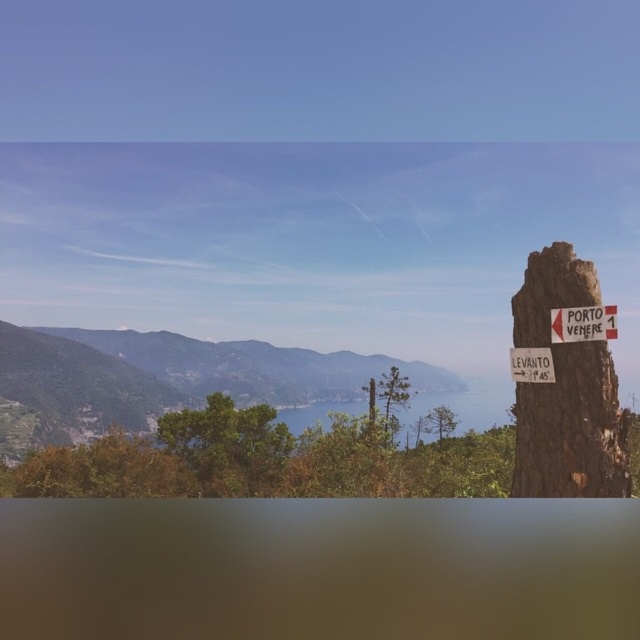
Question: Is green leafy mountain at left below brown wooden signpost at right?

Choices:
 (A) no
 (B) yes

Answer: (B)

Question: Which object is closer to the camera taking this photo?

Choices:
 (A) green leafy tree at center
 (B) green leafy mountain at left
 (C) white plastic sign at right
 (D) brown wooden signpost at right

Answer: (C)

Question: Which object is positioned farthest from the green leafy mountain at left?

Choices:
 (A) brown wooden signpost at right
 (B) white plastic sign at right

Answer: (A)

Question: Which of these objects is positioned farthest from the brown wooden signpost at right?

Choices:
 (A) green leafy tree at center
 (B) green leafy mountain at left

Answer: (B)

Question: Where is green leafy tree at center located in relation to brown wooden signpost at right in the image?

Choices:
 (A) right
 (B) left

Answer: (B)

Question: Can you confirm if green leafy tree at center is bigger than white plastic sign at right?

Choices:
 (A) yes
 (B) no

Answer: (A)